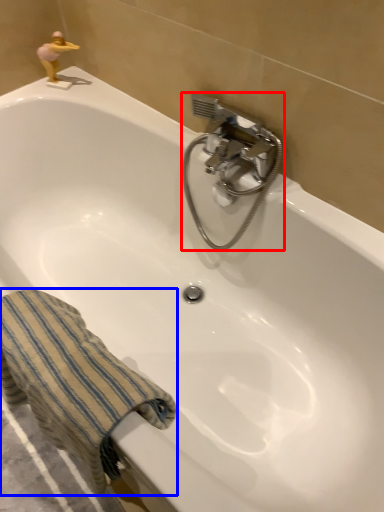
Question: Which object appears closest to the camera in this image, plumbing fixture (highlighted by a red box) or towel/napkin (highlighted by a blue box)?

Choices:
 (A) plumbing fixture
 (B) towel/napkin

Answer: (B)